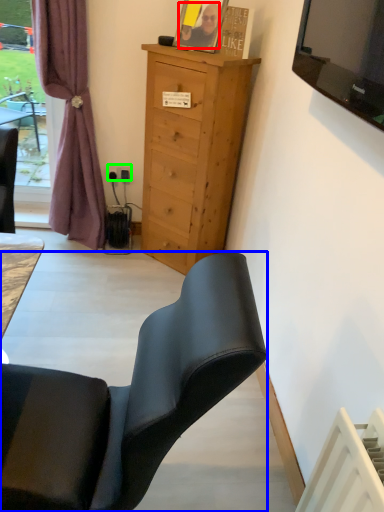
Question: Which object is the farthest from person (highlighted by a red box)? Choose among these: chair (highlighted by a blue box) or power outlet (highlighted by a green box).

Choices:
 (A) chair
 (B) power outlet

Answer: (A)